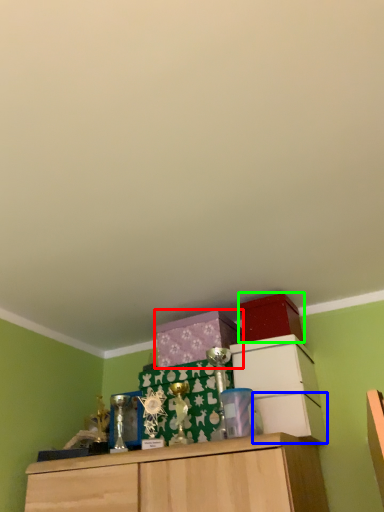
Question: Estimate the real-world distances between objects in this image. Which object is farther from cabinetry (highlighted by a red box), drawer (highlighted by a blue box) or storage box (highlighted by a green box)?

Choices:
 (A) drawer
 (B) storage box

Answer: (A)